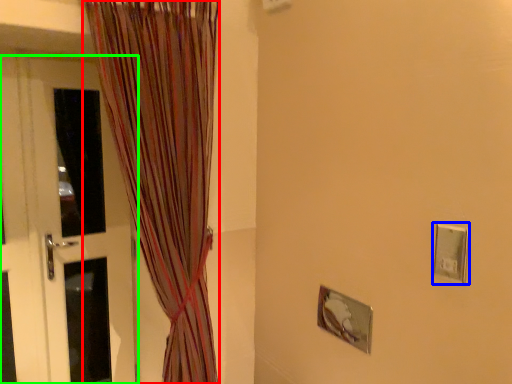
Question: Estimate the real-world distances between objects in this image. Which object is closer to curtain (highlighted by a red box), electric outlet (highlighted by a blue box) or door (highlighted by a green box)?

Choices:
 (A) electric outlet
 (B) door

Answer: (B)